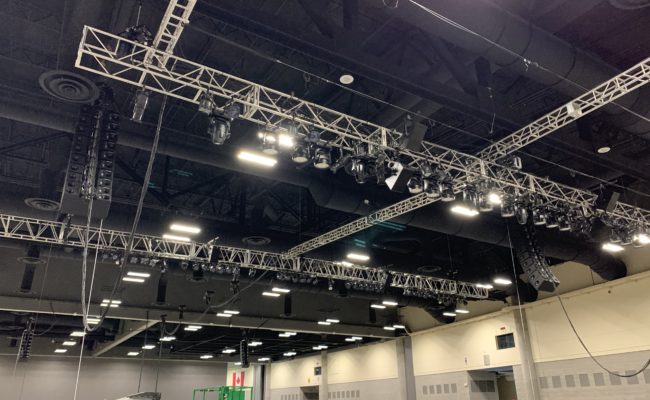
I want to click on gray wall, so click(88, 375), click(387, 389).